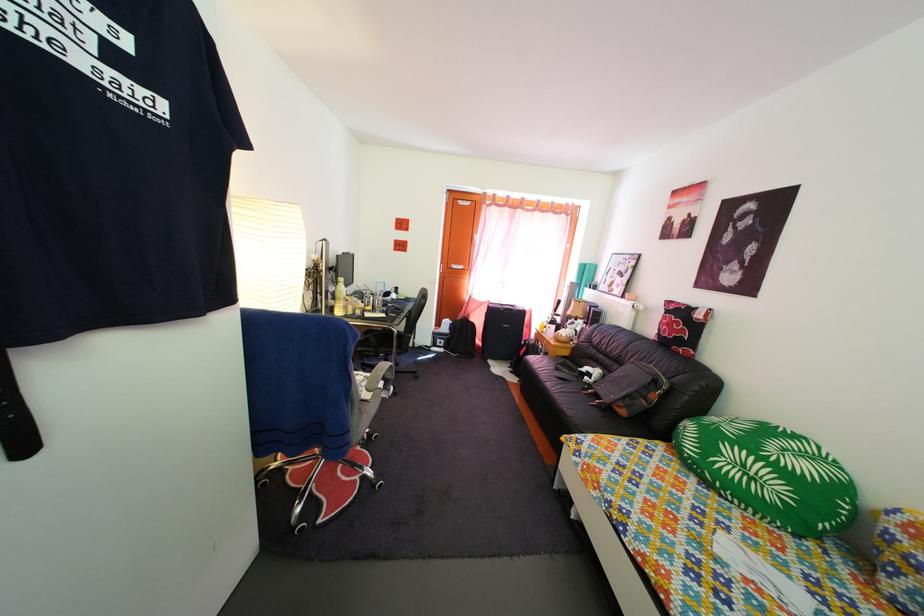
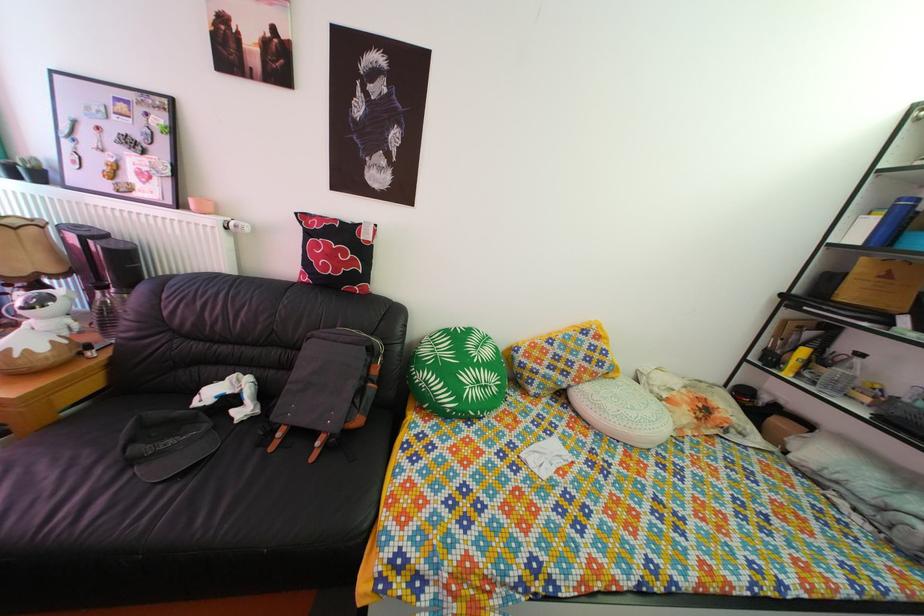
In the second image, find the point that corresponds to [762,487] in the first image.

(494, 395)